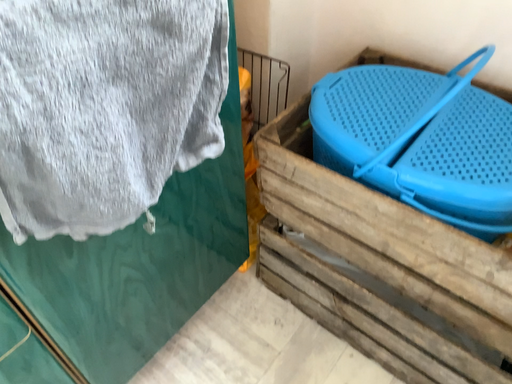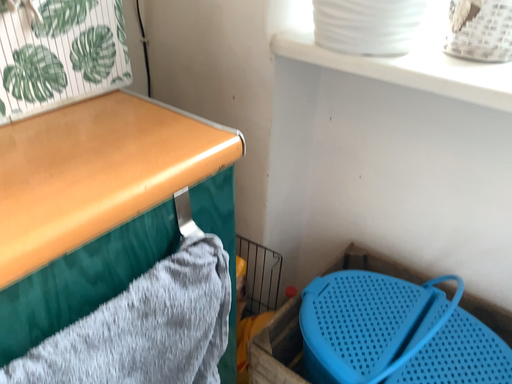
Question: How did the camera likely rotate when shooting the video?

Choices:
 (A) rotated downward
 (B) rotated upward

Answer: (B)